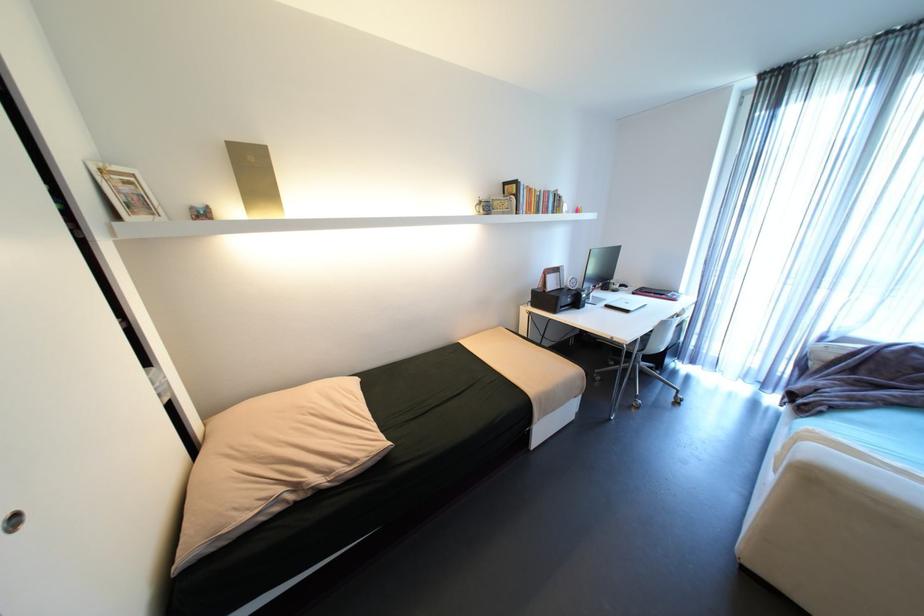
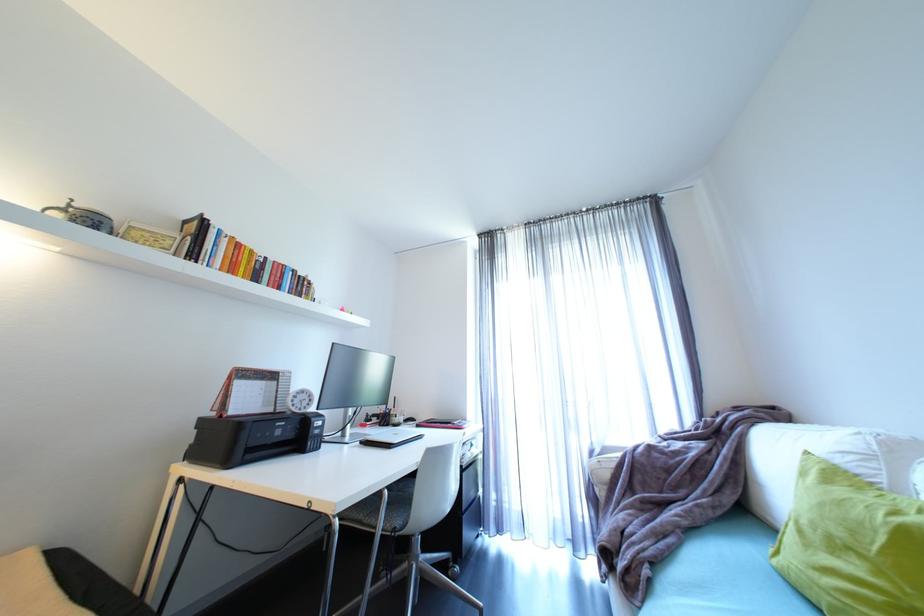
In the second image, find the point that corresponds to [671,294] in the first image.

(457, 424)